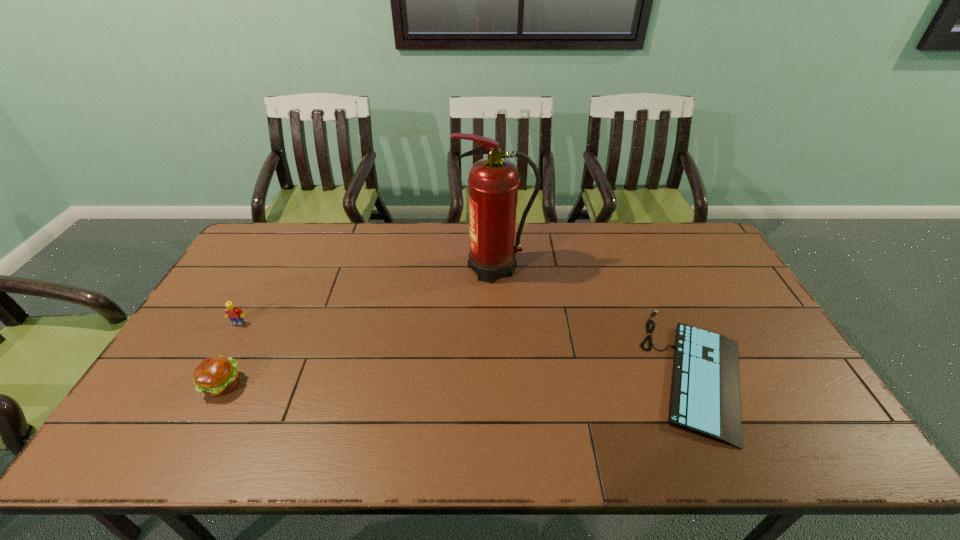
Locate an element on the screen. The width and height of the screenshot is (960, 540). vacant space located 0.150m on the back of the hamburger is located at coordinates (252, 327).

At what (x,y) coordinates should I click in order to perform the action: click on vacant space located 0.090m on the back of the shortest object. Please return your answer as a coordinate pair (x, y). Looking at the image, I should click on (663, 291).

The image size is (960, 540). Find the location of `object that is at the far edge`. object that is at the far edge is located at coordinates (493, 182).

Where is `object present at the near edge`? The image size is (960, 540). object present at the near edge is located at coordinates (705, 392).

I want to click on Lego that is at the left edge, so click(236, 315).

I want to click on hamburger at the left edge, so click(215, 376).

The image size is (960, 540). What are the coordinates of `object that is at the right edge` in the screenshot? It's located at (705, 392).

Where is `object present at the near right corner`? object present at the near right corner is located at coordinates (705, 392).

In the image, there is a desktop. At what (x,y) coordinates should I click in order to perform the action: click on vacant space at the far edge. Please return your answer as a coordinate pair (x, y). This screenshot has width=960, height=540. Looking at the image, I should click on (353, 237).

The width and height of the screenshot is (960, 540). In order to click on free space at the near edge of the desktop in this screenshot , I will do `click(660, 438)`.